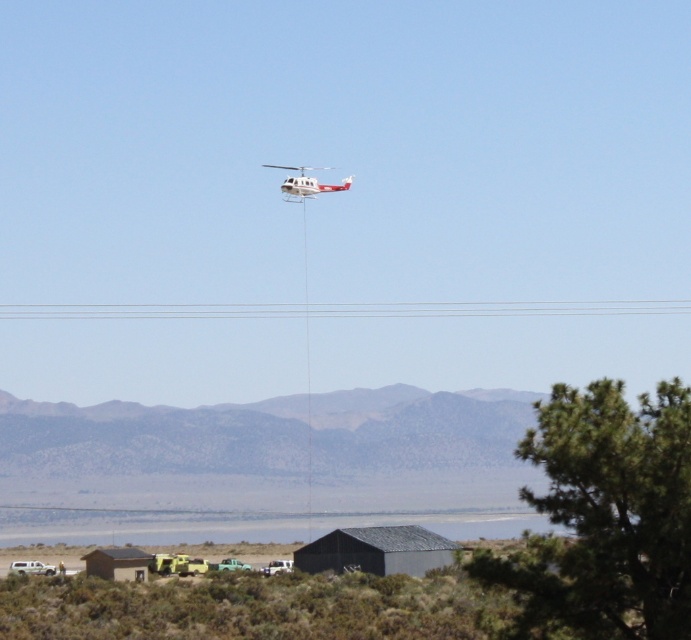
Question: Where is green grass at lower center located in relation to white matte helicopter at upper center in the image?

Choices:
 (A) right
 (B) left

Answer: (B)

Question: Which object is closer to the camera taking this photo?

Choices:
 (A) green grass at lower center
 (B) white matte helicopter at upper center

Answer: (A)

Question: Does green grass at lower center appear on the right side of white matte helicopter at upper center?

Choices:
 (A) no
 (B) yes

Answer: (A)

Question: From the image, what is the correct spatial relationship of green grass at lower center in relation to white matte helicopter at upper center?

Choices:
 (A) left
 (B) right

Answer: (A)